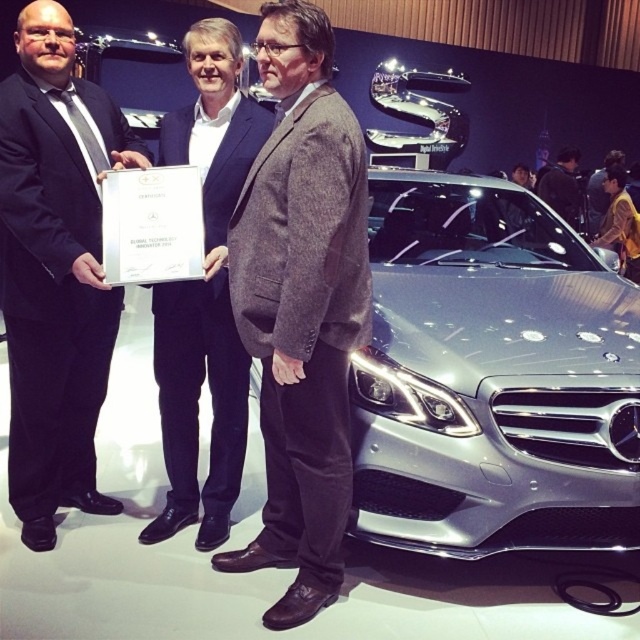
You are an event organizer at the auto show. You need to arrange two items on a table for a presentation. The items are the black suit at left and the yellow fabric shirt at right. Which item requires a larger table space due to its size?

The yellow fabric shirt at right requires a larger table space because the black suit at left occupies less space than the yellow fabric shirt at right.

You are standing at the entrance of the exhibition hall and want to take a photo of the sleek metallic car at center. Based on its position, which direction should you walk towards to get the best view?

The sleek metallic car at center is located at point coordinates, but without specific directional context, the best approach is to move towards the center of the exhibition hall to ensure a clear view of the car.